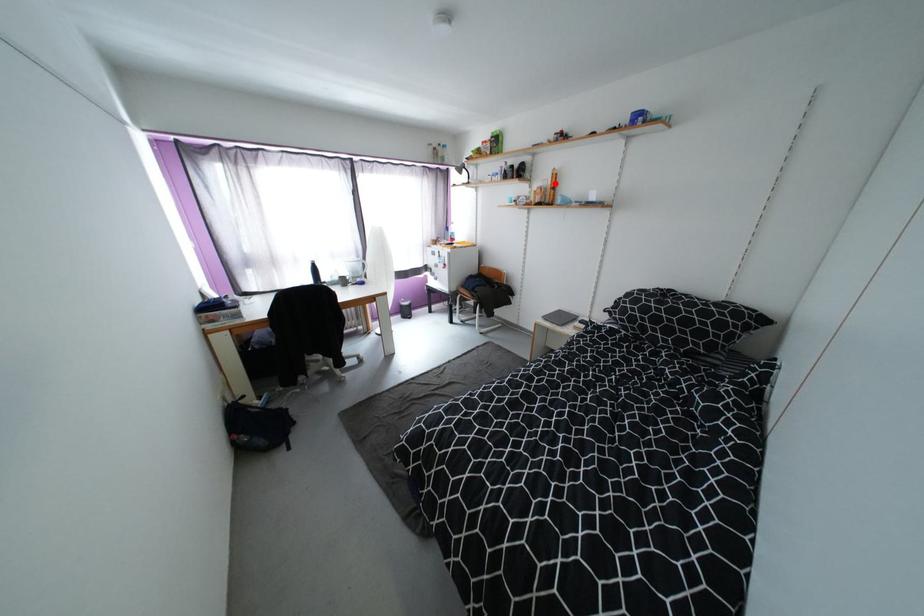
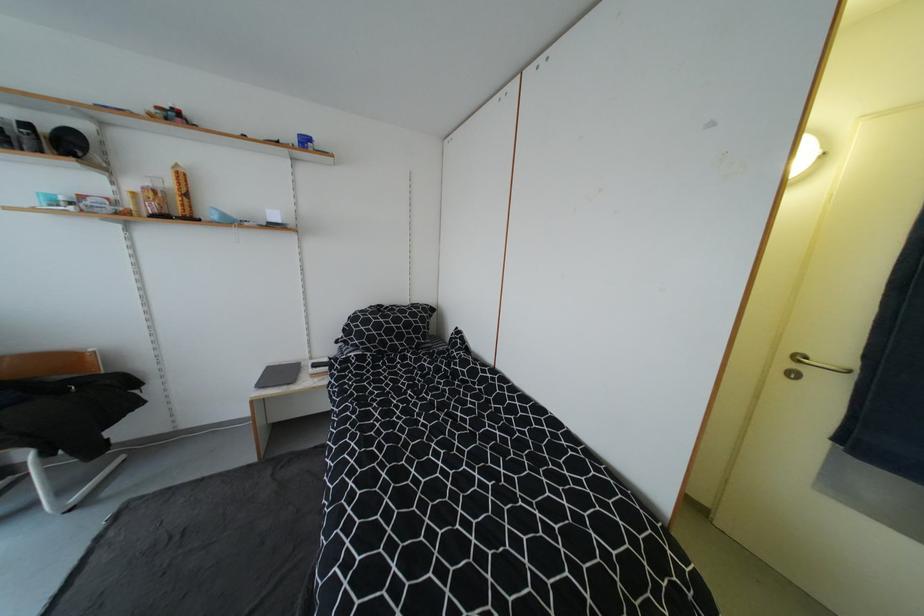
Question: A red point is marked in image1. In image2, is the corresponding 3D point closer to the camera or farther? Reply with the corresponding letter.

Choices:
 (A) The corresponding 3D point is closer.
 (B) The corresponding 3D point is farther.

Answer: (B)